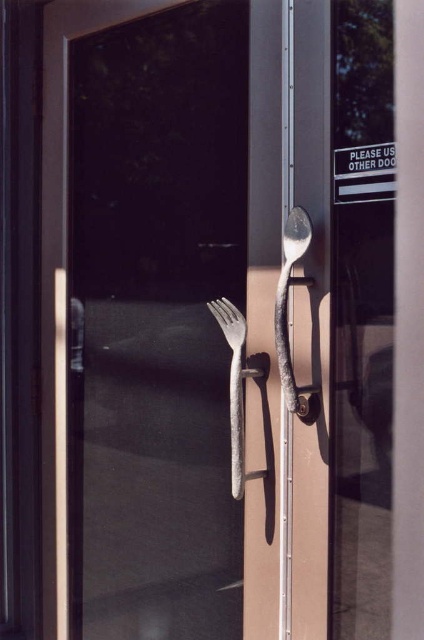
Question: Can you confirm if shiny silver spoon at center is positioned to the left of rusty metal fork at center?

Choices:
 (A) yes
 (B) no

Answer: (B)

Question: Which object appears farthest from the camera in this image?

Choices:
 (A) rusty metal fork at center
 (B) shiny silver spoon at center

Answer: (A)

Question: Which point appears closest to the camera in this image?

Choices:
 (A) (239, 339)
 (B) (303, 241)

Answer: (B)

Question: Can you confirm if shiny silver spoon at center is positioned to the right of rusty metal fork at center?

Choices:
 (A) yes
 (B) no

Answer: (A)

Question: Is shiny silver spoon at center thinner than rusty metal fork at center?

Choices:
 (A) yes
 (B) no

Answer: (A)